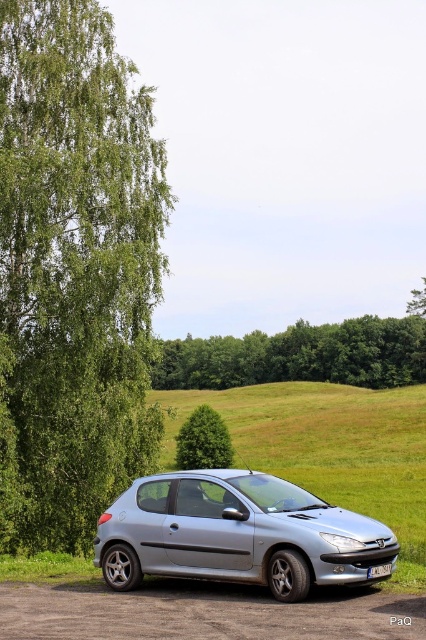
Does green leafy tree at center appear on the left side of white plastic license plate at lower center?

Correct, you'll find green leafy tree at center to the left of white plastic license plate at lower center.

Between green leafy tree at center and white plastic license plate at lower center, which one has less height?

white plastic license plate at lower center is shorter.

Is point (210, 432) positioned behind point (368, 568)?

Yes, point (210, 432) is farther from viewer.

The image size is (426, 640). Find the location of `green leafy tree at center`. green leafy tree at center is located at coordinates (204, 442).

Can you confirm if green leafy tree at left is shorter than white plastic license plate at lower center?

No, green leafy tree at left is not shorter than white plastic license plate at lower center.

Who is more forward, (x=106, y=115) or (x=385, y=563)?

Point (x=385, y=563) is more forward.

Image resolution: width=426 pixels, height=640 pixels. What do you see at coordinates (74, 273) in the screenshot?
I see `green leafy tree at left` at bounding box center [74, 273].

You are a GUI agent. You are given a task and a screenshot of the screen. Output one action in this format:
    pyautogui.click(x=<x>, y=<y>)
    Task: Click on the green leafy tree at left
    This screenshot has width=426, height=640.
    Given the screenshot: What is the action you would take?
    pyautogui.click(x=74, y=273)

Can you confirm if silver metallic car at center is positioned above white plastic license plate at lower center?

Actually, silver metallic car at center is below white plastic license plate at lower center.

Can you confirm if silver metallic car at center is positioned to the right of white plastic license plate at lower center?

No, silver metallic car at center is not to the right of white plastic license plate at lower center.

Which is behind, point (253, 496) or point (377, 573)?

Positioned behind is point (253, 496).

You are a GUI agent. You are given a task and a screenshot of the screen. Output one action in this format:
    pyautogui.click(x=<x>, y=<y>)
    Task: Click on the silver metallic car at center
    The height and width of the screenshot is (640, 426).
    Given the screenshot: What is the action you would take?
    pyautogui.click(x=236, y=532)